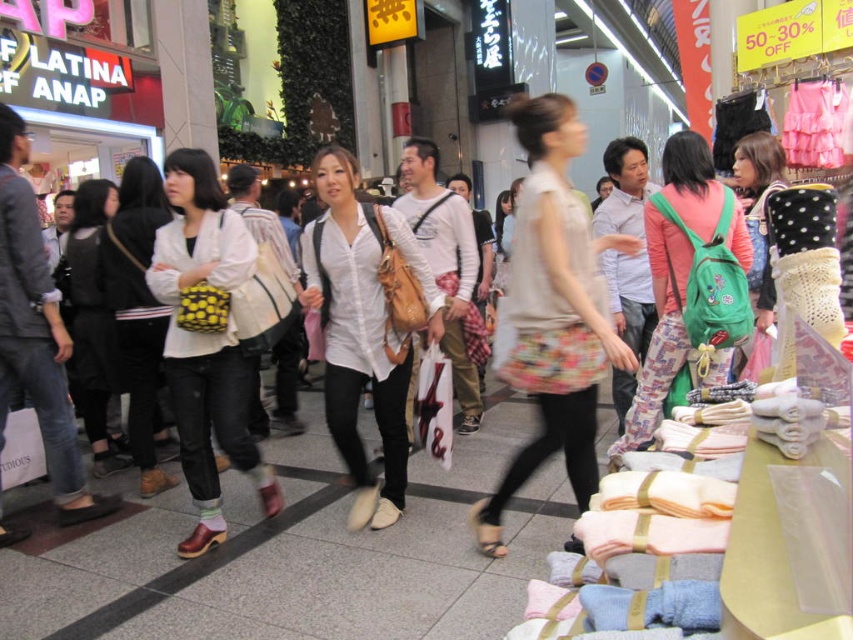
Question: Is floral skirt at center closer to camera compared to matte black jacket at center?

Choices:
 (A) no
 (B) yes

Answer: (B)

Question: Among these points, which one is farthest from the camera?

Choices:
 (A) [x=219, y=412]
 (B) [x=697, y=376]
 (C) [x=80, y=328]

Answer: (C)

Question: Which point is closer to the camera taking this photo?

Choices:
 (A) (119, 458)
 (B) (561, 184)
 (C) (656, 275)

Answer: (B)

Question: Does floral skirt at center appear on the right side of green backpack at center?

Choices:
 (A) yes
 (B) no

Answer: (B)

Question: Can you confirm if white matte shirt at center is bigger than matte yellow bag at center?

Choices:
 (A) yes
 (B) no

Answer: (A)

Question: Which object is farther from the camera taking this photo?

Choices:
 (A) matte yellow bag at center
 (B) matte yellow and black bag at center

Answer: (A)